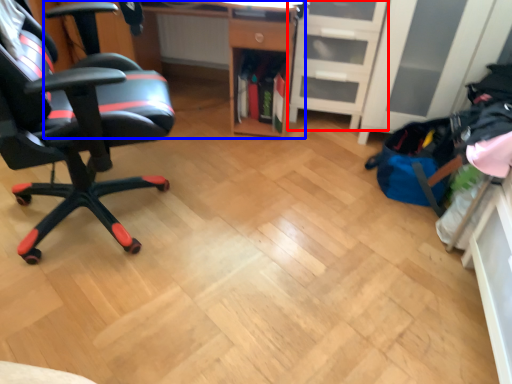
Question: Among these objects, which one is farthest to the camera, file cabinet (highlighted by a red box) or desk (highlighted by a blue box)?

Choices:
 (A) file cabinet
 (B) desk

Answer: (A)